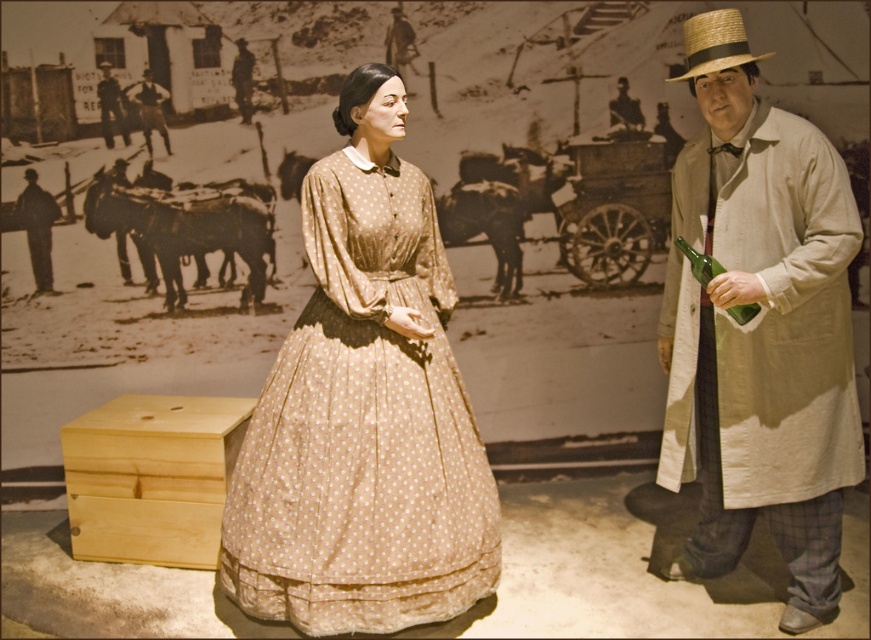
Question: Considering the real-world distances, which object is closest to the rustic wood gun at upper left?

Choices:
 (A) light beige fabric coat at right
 (B) strawmaterial/texturehat at upper right

Answer: (B)

Question: Which point is closer to the camera?

Choices:
 (A) (107, 109)
 (B) (780, 221)

Answer: (B)

Question: Is brown leather jacket at left below rustic wood gun at upper left?

Choices:
 (A) no
 (B) yes

Answer: (B)

Question: Where is matte beige dress at center located in relation to dark brown leather jacket at upper left in the image?

Choices:
 (A) below
 (B) above

Answer: (A)

Question: Which point is closer to the camera taking this photo?

Choices:
 (A) (446, 593)
 (B) (694, 317)

Answer: (A)

Question: Is strawmaterial/texturehat at upper right above brown leather jacket at left?

Choices:
 (A) yes
 (B) no

Answer: (A)